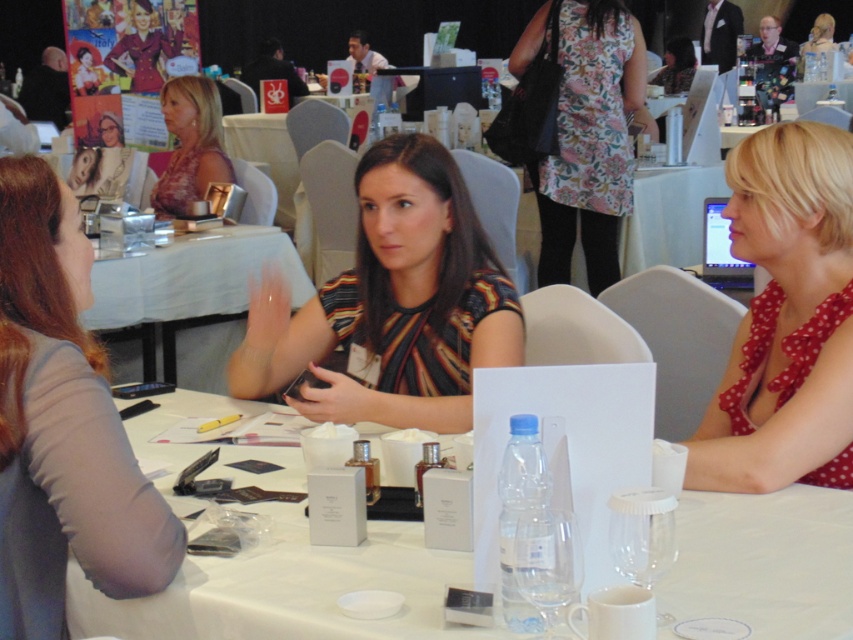
Question: Does clear plastic bottle at center have a lesser width compared to matte pink dress at center?

Choices:
 (A) no
 (B) yes

Answer: (A)

Question: Which point is farther from the camera taking this photo?

Choices:
 (A) coord(79,579)
 (B) coord(614,241)
 (C) coord(769,240)
 (D) coord(204,301)

Answer: (B)

Question: In this image, where is clear plastic bottle at center located relative to polka dot fabric dress at right?

Choices:
 (A) above
 (B) below

Answer: (B)

Question: Which object appears closest to the camera in this image?

Choices:
 (A) striped fabric shirt at center
 (B) clear plastic bottle at center

Answer: (B)

Question: Which object is positioned closest to the polka dot fabric dress at right?

Choices:
 (A) floral fabric dress at center
 (B) clear plastic bottle at center
 (C) gray fabric shirt at left
 (D) striped fabric shirt at center

Answer: (B)

Question: Does clear plastic bottle at center have a lesser width compared to polka dot fabric dress at right?

Choices:
 (A) yes
 (B) no

Answer: (B)